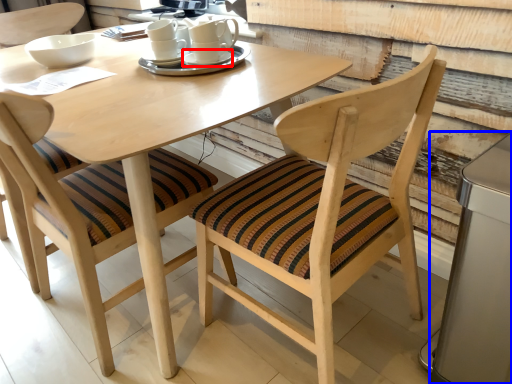
Question: Which of the following is the farthest to the observer, saucer (highlighted by a red box) or appliance (highlighted by a blue box)?

Choices:
 (A) saucer
 (B) appliance

Answer: (A)